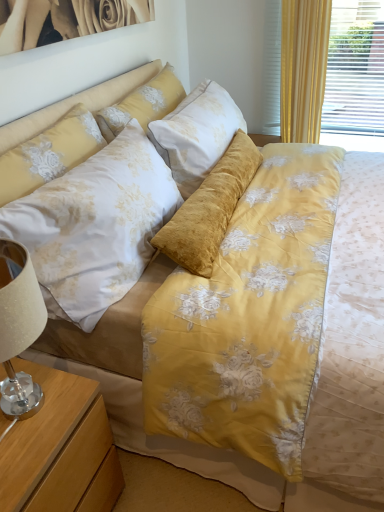
You are a GUI agent. You are given a task and a screenshot of the screen. Output one action in this format:
    pyautogui.click(x=<x>, y=<y>)
    Task: Click on the white glossy picture frame at upper left
    This screenshot has width=384, height=512.
    Given the screenshot: What is the action you would take?
    pyautogui.click(x=66, y=19)

What do you see at coordinates (60, 449) in the screenshot?
I see `wooden nightstand at lower left` at bounding box center [60, 449].

This screenshot has width=384, height=512. What do you see at coordinates (49, 154) in the screenshot? I see `floral satin pillow at upper left, placed as the 2th pillow when sorted from back to front` at bounding box center [49, 154].

Where is `floral fabric pillow at upper center, which is the 2th pillow in front-to-back order`? floral fabric pillow at upper center, which is the 2th pillow in front-to-back order is located at coordinates (143, 104).

Is point (92, 137) positioned before point (159, 115)?

Yes, it is in front of point (159, 115).

Is floral satin pillow at upper left, placed as the 2th pillow when sorted from back to front, positioned with its back to floral fabric pillow at upper center, which is the 2th pillow in front-to-back order?

No, floral fabric pillow at upper center, which is the 2th pillow in front-to-back order, is not at the back of floral satin pillow at upper left, placed as the 2th pillow when sorted from back to front.

How far apart are floral satin pillow at upper left, the 1th pillow from the front, and floral fabric pillow at upper center, which is the 2th pillow in front-to-back order?

The distance of floral satin pillow at upper left, the 1th pillow from the front, from floral fabric pillow at upper center, which is the 2th pillow in front-to-back order, is 12.34 inches.

From a real-world perspective, is floral satin pillow at upper left, the 1th pillow from the front, above or below floral fabric pillow at upper center, which is the 2th pillow in front-to-back order?

From a real-world perspective, floral satin pillow at upper left, the 1th pillow from the front, is physically below floral fabric pillow at upper center, which is the 2th pillow in front-to-back order.

From the image's perspective, is white glossy picture frame at upper left on top of wooden nightstand at lower left?

Yes, from the image's perspective, white glossy picture frame at upper left is on top of wooden nightstand at lower left.

Is the depth of white glossy picture frame at upper left less than that of wooden nightstand at lower left?

No, the depth of white glossy picture frame at upper left is greater than that of wooden nightstand at lower left.

Considering the relative sizes of white glossy picture frame at upper left and wooden nightstand at lower left in the image provided, is white glossy picture frame at upper left shorter than wooden nightstand at lower left?

Correct, white glossy picture frame at upper left is not as tall as wooden nightstand at lower left.

From a real-world perspective, is white glossy picture frame at upper left on wooden nightstand at lower left?

Yes, from a real-world perspective, white glossy picture frame at upper left is above wooden nightstand at lower left.

Is wooden nightstand at lower left facing towards floral satin pillow at upper left, placed as the 2th pillow when sorted from back to front?

No, wooden nightstand at lower left is not turned towards floral satin pillow at upper left, placed as the 2th pillow when sorted from back to front.

Considering the relative sizes of wooden nightstand at lower left and floral satin pillow at upper left, the 1th pillow from the front, in the image provided, is wooden nightstand at lower left shorter than floral satin pillow at upper left, the 1th pillow from the front,?

No.

Measure the distance from wooden nightstand at lower left to floral satin pillow at upper left, the 1th pillow from the front.

A distance of 25.67 inches exists between wooden nightstand at lower left and floral satin pillow at upper left, the 1th pillow from the front.

Does wooden nightstand at lower left contain floral satin pillow at upper left, placed as the 2th pillow when sorted from back to front?

No, floral satin pillow at upper left, placed as the 2th pillow when sorted from back to front, is not inside wooden nightstand at lower left.

Which object is positioned more to the right, floral fabric pillow at upper center, which is the 2th pillow in front-to-back order, or wooden nightstand at lower left?

floral fabric pillow at upper center, which is the 2th pillow in front-to-back order.

Where is `nightstand in front of the floral fabric pillow at upper center, positioned as the 1th pillow in back-to-front order`? The image size is (384, 512). nightstand in front of the floral fabric pillow at upper center, positioned as the 1th pillow in back-to-front order is located at coordinates click(60, 449).

Is floral fabric pillow at upper center, positioned as the 1th pillow in back-to-front order, shorter than wooden nightstand at lower left?

Correct, floral fabric pillow at upper center, positioned as the 1th pillow in back-to-front order, is not as tall as wooden nightstand at lower left.

Which object is closer to the camera taking this photo, floral fabric pillow at upper center, which is the 2th pillow in front-to-back order, or wooden nightstand at lower left?

wooden nightstand at lower left is in front.

From the picture: Could you measure the distance between floral fabric pillow at upper center, which is the 2th pillow in front-to-back order, and white glossy picture frame at upper left?

floral fabric pillow at upper center, which is the 2th pillow in front-to-back order, is 12.51 inches from white glossy picture frame at upper left.

Looking at their sizes, would you say floral fabric pillow at upper center, which is the 2th pillow in front-to-back order, is wider or thinner than white glossy picture frame at upper left?

floral fabric pillow at upper center, which is the 2th pillow in front-to-back order, is wider than white glossy picture frame at upper left.

Considering the positions of objects floral fabric pillow at upper center, which is the 2th pillow in front-to-back order, and white glossy picture frame at upper left in the image provided, who is in front, floral fabric pillow at upper center, which is the 2th pillow in front-to-back order, or white glossy picture frame at upper left?

Positioned in front is white glossy picture frame at upper left.

From a real-world perspective, is floral fabric pillow at upper center, which is the 2th pillow in front-to-back order, positioned above or below white glossy picture frame at upper left?

In terms of real-world spatial position, floral fabric pillow at upper center, which is the 2th pillow in front-to-back order, is below white glossy picture frame at upper left.

Is floral satin pillow at upper left, the 1th pillow from the front, touching white glossy picture frame at upper left?

No, floral satin pillow at upper left, the 1th pillow from the front, is not in contact with white glossy picture frame at upper left.

Does floral satin pillow at upper left, placed as the 2th pillow when sorted from back to front, have a larger size compared to white glossy picture frame at upper left?

Yes.

Is floral satin pillow at upper left, the 1th pillow from the front, not within white glossy picture frame at upper left?

floral satin pillow at upper left, the 1th pillow from the front, is positioned outside white glossy picture frame at upper left.

From the picture: Considering the relative positions of floral satin pillow at upper left, placed as the 2th pillow when sorted from back to front, and white glossy picture frame at upper left in the image provided, is floral satin pillow at upper left, placed as the 2th pillow when sorted from back to front, to the right of white glossy picture frame at upper left from the viewer's perspective?

No, floral satin pillow at upper left, placed as the 2th pillow when sorted from back to front, is not to the right of white glossy picture frame at upper left.

Can you confirm if floral fabric pillow at upper center, positioned as the 1th pillow in back-to-front order, is shorter than floral satin pillow at upper left, the 1th pillow from the front?

Correct, floral fabric pillow at upper center, positioned as the 1th pillow in back-to-front order, is not as tall as floral satin pillow at upper left, the 1th pillow from the front.

Visually, is floral fabric pillow at upper center, positioned as the 1th pillow in back-to-front order, positioned to the left or to the right of floral satin pillow at upper left, placed as the 2th pillow when sorted from back to front?

floral fabric pillow at upper center, positioned as the 1th pillow in back-to-front order, is positioned on floral satin pillow at upper left, placed as the 2th pillow when sorted from back to front,'s right side.

Measure the distance from floral fabric pillow at upper center, positioned as the 1th pillow in back-to-front order, to floral satin pillow at upper left, the 1th pillow from the front.

floral fabric pillow at upper center, positioned as the 1th pillow in back-to-front order, is 12.34 inches from floral satin pillow at upper left, the 1th pillow from the front.

Would you say floral fabric pillow at upper center, positioned as the 1th pillow in back-to-front order, is inside or outside floral satin pillow at upper left, the 1th pillow from the front?

The correct answer is: outside.

This screenshot has height=512, width=384. In order to click on pillow behind the floral satin pillow at upper left, placed as the 2th pillow when sorted from back to front in this screenshot , I will do `click(143, 104)`.

What are the coordinates of `picture frame to the right of wooden nightstand at lower left` in the screenshot? It's located at (66, 19).

Estimate the real-world distances between objects in this image. Which object is closer to floral satin pillow at upper left, the 1th pillow from the front, floral fabric pillow at upper center, which is the 2th pillow in front-to-back order, or white glossy picture frame at upper left?

floral fabric pillow at upper center, which is the 2th pillow in front-to-back order.

Estimate the real-world distances between objects in this image. Which object is further from floral fabric pillow at upper center, which is the 2th pillow in front-to-back order, white glossy picture frame at upper left or wooden nightstand at lower left?

wooden nightstand at lower left is positioned further to the anchor floral fabric pillow at upper center, which is the 2th pillow in front-to-back order.

Looking at this image, when comparing their distances from floral satin pillow at upper left, placed as the 2th pillow when sorted from back to front, does floral fabric pillow at upper center, which is the 2th pillow in front-to-back order, or wooden nightstand at lower left seem further?

wooden nightstand at lower left.

Looking at the image, which one is located further to floral satin pillow at upper left, the 1th pillow from the front, white glossy picture frame at upper left or floral fabric pillow at upper center, which is the 2th pillow in front-to-back order?

white glossy picture frame at upper left is further to floral satin pillow at upper left, the 1th pillow from the front.

Looking at the image, which one is located closer to wooden nightstand at lower left, white glossy picture frame at upper left or floral fabric pillow at upper center, positioned as the 1th pillow in back-to-front order?

Based on the image, floral fabric pillow at upper center, positioned as the 1th pillow in back-to-front order, appears to be nearer to wooden nightstand at lower left.

Which object lies further to the anchor point white glossy picture frame at upper left, wooden nightstand at lower left or floral fabric pillow at upper center, which is the 2th pillow in front-to-back order?

Among the two, wooden nightstand at lower left is located further to white glossy picture frame at upper left.

Considering their positions, is wooden nightstand at lower left positioned further to white glossy picture frame at upper left than floral satin pillow at upper left, the 1th pillow from the front?

Based on the image, wooden nightstand at lower left appears to be further to white glossy picture frame at upper left.

Based on their spatial positions, is floral satin pillow at upper left, placed as the 2th pillow when sorted from back to front, or white glossy picture frame at upper left further from floral fabric pillow at upper center, which is the 2th pillow in front-to-back order?

Among the two, white glossy picture frame at upper left is located further to floral fabric pillow at upper center, which is the 2th pillow in front-to-back order.

Locate an element on the screen. This screenshot has width=384, height=512. pillow between white glossy picture frame at upper left and floral satin pillow at upper left, placed as the 2th pillow when sorted from back to front, vertically is located at coordinates (143, 104).

Image resolution: width=384 pixels, height=512 pixels. I want to click on pillow between floral fabric pillow at upper center, which is the 2th pillow in front-to-back order, and wooden nightstand at lower left from top to bottom, so click(x=49, y=154).